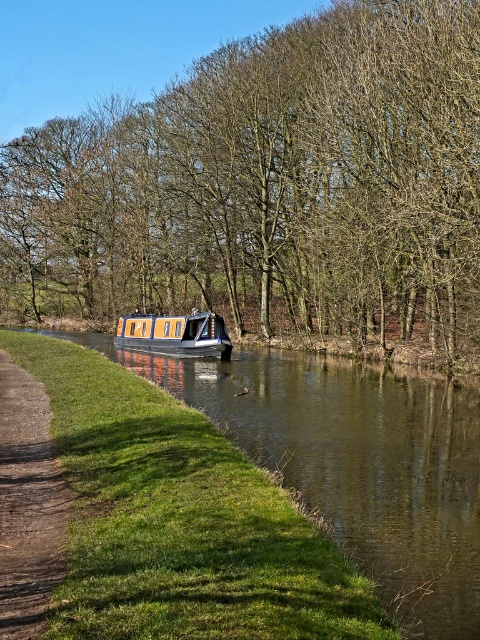
Question: From the image, what is the correct spatial relationship of smooth brown water at center in relation to orange polished wood boat at center?

Choices:
 (A) right
 (B) left

Answer: (A)

Question: Among these points, which one is nearest to the camera?

Choices:
 (A) (336, 378)
 (B) (28, 458)
 (C) (186, 316)

Answer: (B)

Question: Is brown leafless trees at center wider than orange polished wood boat at center?

Choices:
 (A) no
 (B) yes

Answer: (B)

Question: Which point is closer to the camera?

Choices:
 (A) smooth brown water at center
 (B) brown dirt path at lower left
 (C) orange polished wood boat at center

Answer: (B)

Question: Does brown leafless trees at center have a greater width compared to brown dirt path at lower left?

Choices:
 (A) yes
 (B) no

Answer: (A)

Question: Among these objects, which one is nearest to the camera?

Choices:
 (A) brown leafless trees at center
 (B) brown dirt path at lower left
 (C) smooth brown water at center
 (D) orange polished wood boat at center

Answer: (B)